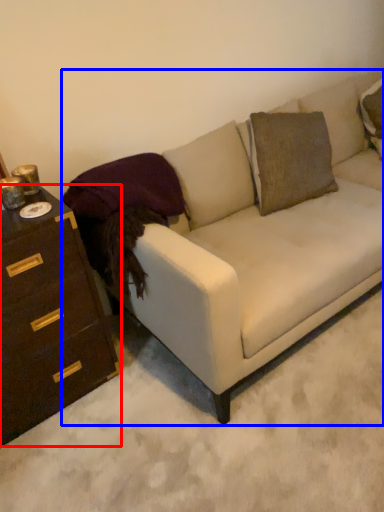
Question: Which point is further to the camera, chest of drawers (highlighted by a red box) or studio couch (highlighted by a blue box)?

Choices:
 (A) chest of drawers
 (B) studio couch

Answer: (A)